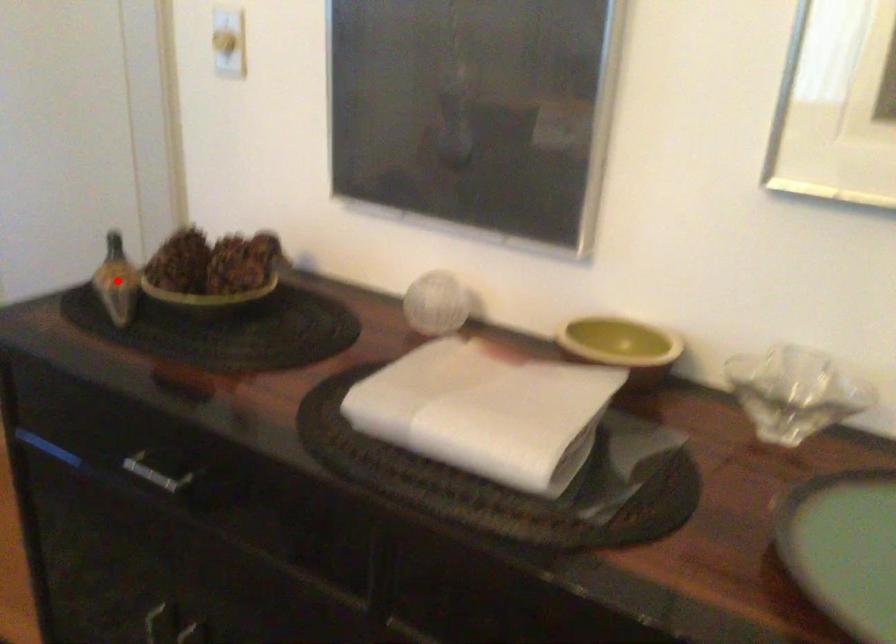
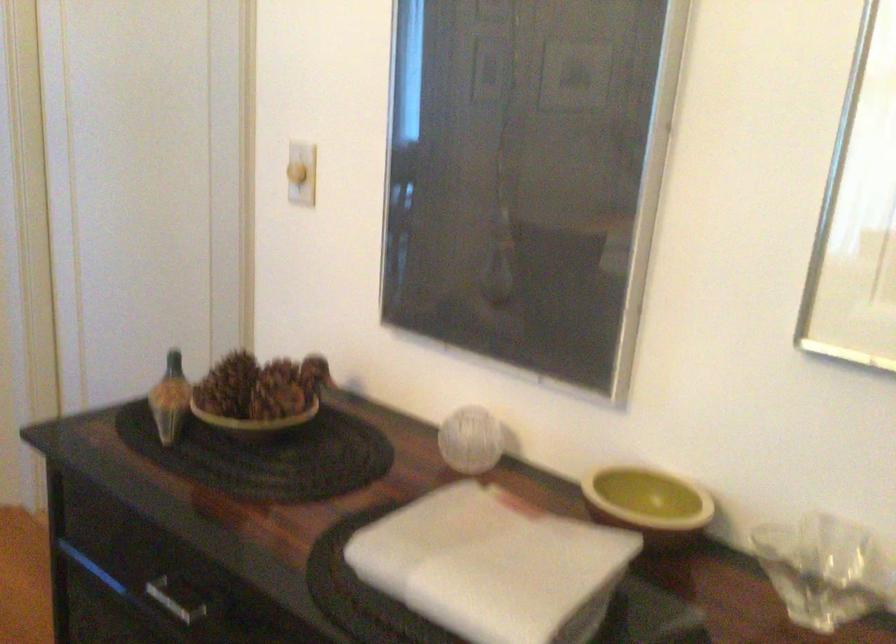
Locate, in the second image, the point that corresponds to the highlighted location in the first image.

(169, 399)